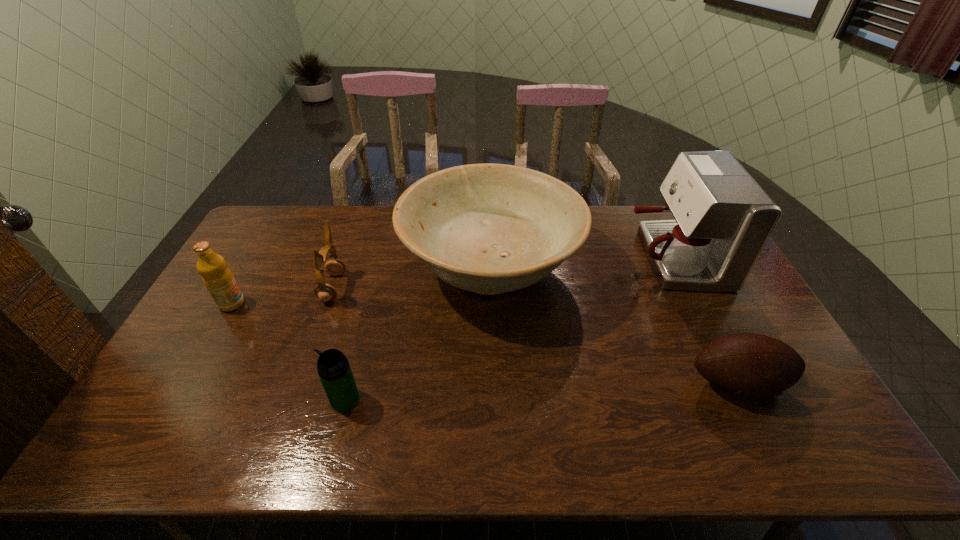
Identify the location of unoccupied position between the thermos bottle and the dish. This screenshot has height=540, width=960. (418, 334).

The height and width of the screenshot is (540, 960). I want to click on vacant area that lies between the third object from right to left and the coffee maker, so click(x=582, y=263).

Locate an element on the screen. The image size is (960, 540). empty space between the fruit juice and the third object from left to right is located at coordinates (288, 351).

Where is `vacant area that lies between the dish and the football`? vacant area that lies between the dish and the football is located at coordinates (614, 326).

Locate an element on the screen. Image resolution: width=960 pixels, height=540 pixels. free spot between the shortest object and the tallest object is located at coordinates (706, 320).

Identify the location of empty space that is in between the leftmost object and the shortest object. click(485, 343).

The height and width of the screenshot is (540, 960). Identify the location of the closest object to the fruit juice. (325, 292).

Choose which object is the nearest neighbor to the shortest object. Please provide its 2D coordinates. Your answer should be formatted as a tuple, i.e. [(x, y)], where the tuple contains the x and y coordinates of a point satisfying the conditions above.

[(488, 228)]

Locate an element on the screen. The image size is (960, 540). free space that satisfies the following two spatial constraints: 1. on the front of the tallest object near the spout; 2. on the front side of the dish is located at coordinates (679, 269).